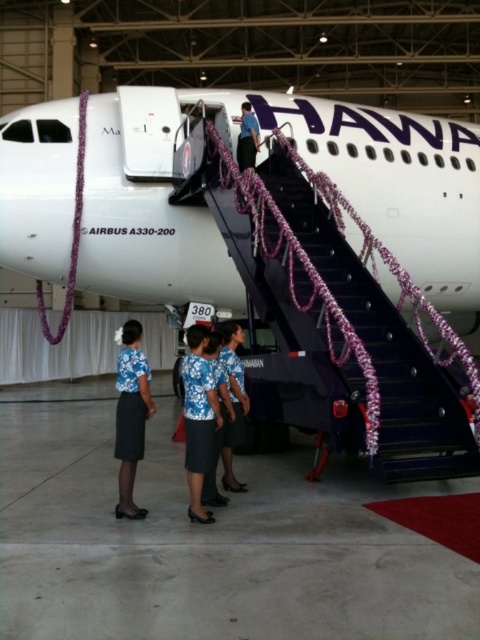
Looking at this image, you are a photographer standing in front of the Hawaiian Airlines Airbus A330. You notice two blue items in the scene. The first is the blue fabric skirt at lower center, and the second is the blue floral dress at center. Which of these items is positioned higher up in the image?

The blue fabric skirt at lower center is located above the blue floral dress at center, so the blue fabric skirt at lower center is positioned higher up in the image.

Consider the image. You are an event planner organizing a photo shoot in the hangar. You need to position two models wearing the blue fabric skirt at lower center and the blue floral dress at center. Based on the scene description, which model should stand closer to the Hawaiian Airlines aircraft to ensure their outfit details are clearly visible in the photos?

The blue fabric skirt at lower center is smaller than the blue floral dress at center. To ensure visibility of the outfit details, the model wearing the smaller blue fabric skirt at lower center should stand closer to the Hawaiian Airlines aircraft.

You are standing at the camera position and want to walk to the gray concrete tarmac at lower center. How many steps would you need to take if each step covers approximately 3 feet?

The distance between the gray concrete tarmac at lower center and the camera is 9.24 feet. Since each step covers about 3 feet, you would need to take approximately 3 steps to reach the gray concrete tarmac at lower center.